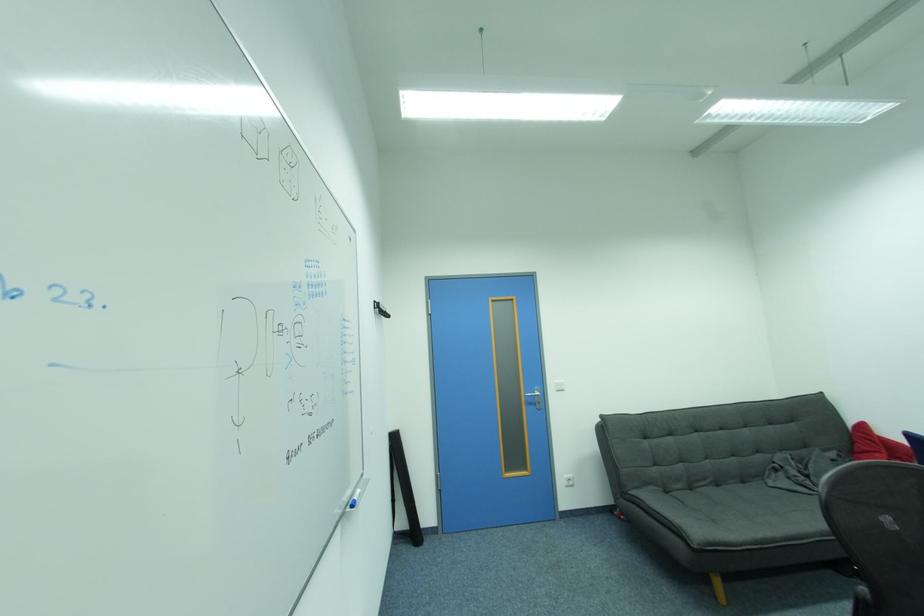
The height and width of the screenshot is (616, 924). Describe the element at coordinates (560, 385) in the screenshot. I see `the white light switch` at that location.